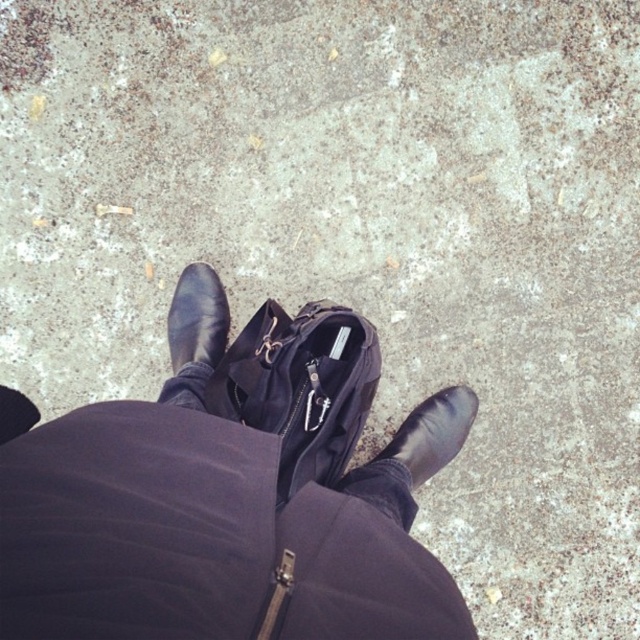
Question: Estimate the real-world distances between objects in this image. Which object is closer to the black leather shoes at center?

Choices:
 (A) black leather shoe at center
 (B) black leather shoe at lower center

Answer: (B)

Question: Does black leather shoes at center have a greater width compared to black leather shoe at center?

Choices:
 (A) yes
 (B) no

Answer: (A)

Question: Is black leather shoes at center smaller than black leather shoe at center?

Choices:
 (A) no
 (B) yes

Answer: (A)

Question: Which object is farther from the camera taking this photo?

Choices:
 (A) black leather shoe at center
 (B) black leather shoe at lower center

Answer: (A)

Question: Which point is farther from the camera taking this photo?

Choices:
 (A) (452, 394)
 (B) (209, 324)

Answer: (B)

Question: Is black leather shoe at lower center smaller than black leather shoe at center?

Choices:
 (A) no
 (B) yes

Answer: (A)